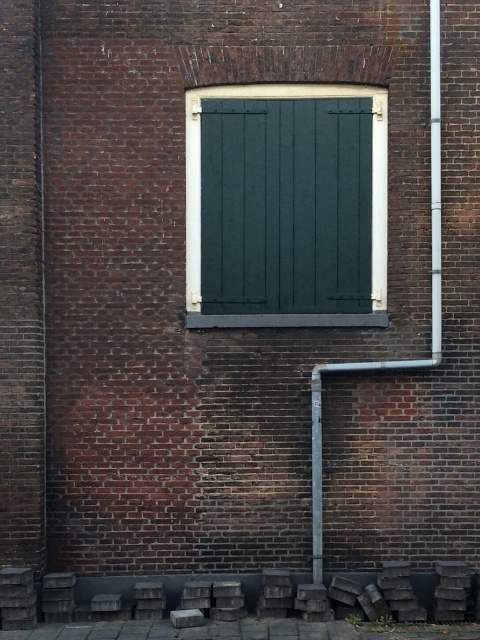
You are an inspector checking the exterior wall. You notice the dark green wood at center and the white metallic pipe at right. Which object is closer to the left side of the wall?

The dark green wood at center is positioned on the left side of the white metallic pipe at right, so it is closer to the left side of the wall.

You are an architect inspecting a building facade. You notice the dark green wood at center and the metallic gray pole at center. Which object would cast a longer shadow at noon given their sizes and positions?

The dark green wood at center has a larger size compared to the metallic gray pole at center, so it would cast a longer shadow at noon.

You are standing in front of the brick wall and want to install a small shelf between the white metallic pipe at right and the metallic gray pole at center. Based on their positions, which object is on the left side so you can place the shelf to its right?

The metallic gray pole at center is on the left side of the white metallic pipe at right, so you should place the shelf to the right of the metallic gray pole at center.